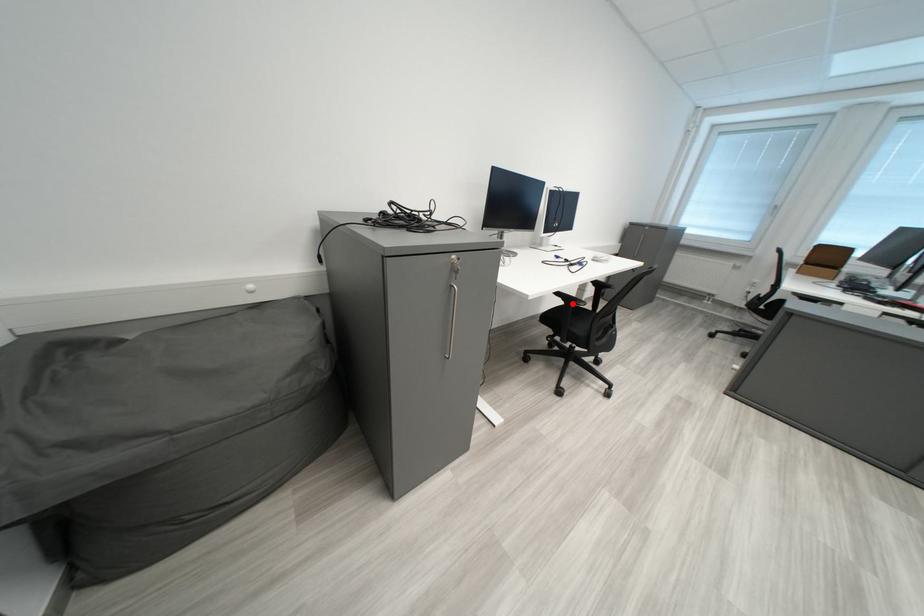
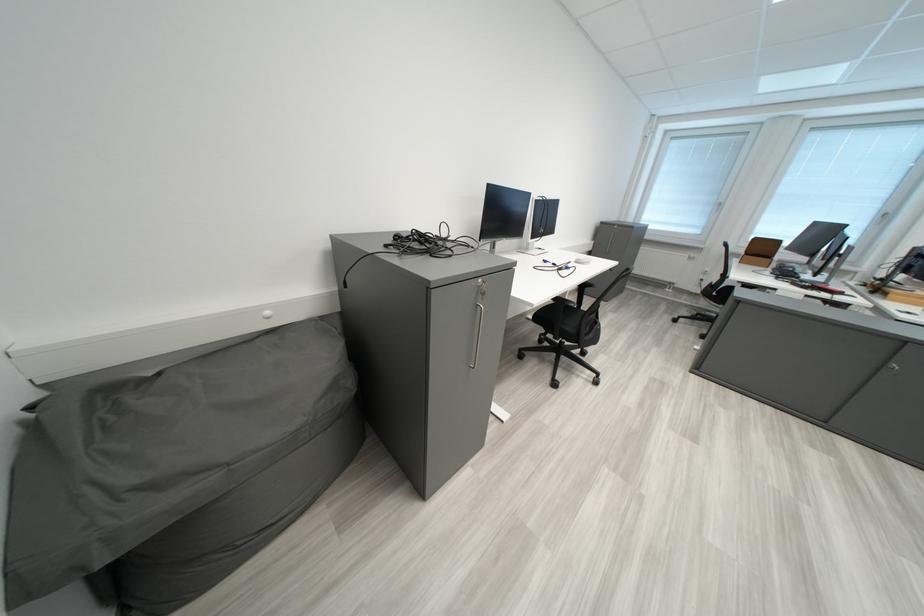
Question: I am providing you with two images of the same scene from different viewpoints. A red point is marked on the first image. At the location where the point appears in image 1, is it still visible in image 2?

Choices:
 (A) Yes
 (B) No

Answer: (B)